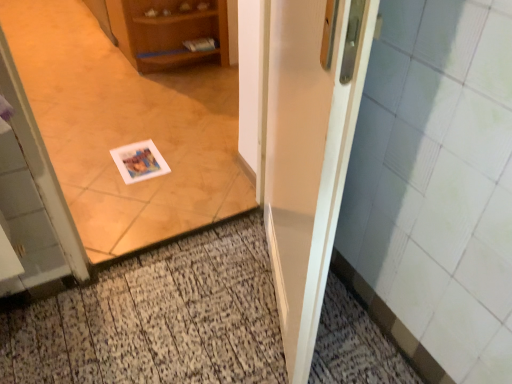
Identify the location of free area below white paper at center (from a real-world perspective). (187, 247).